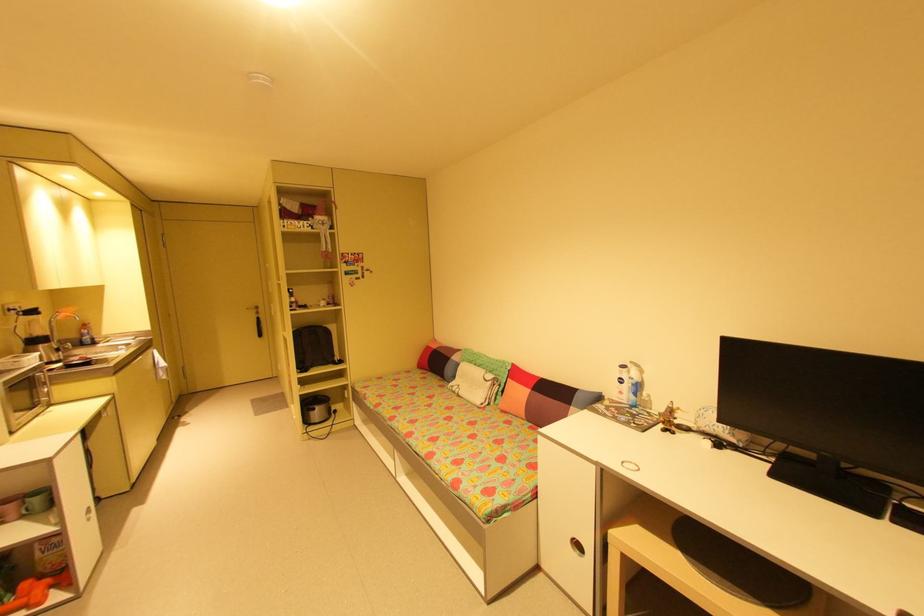
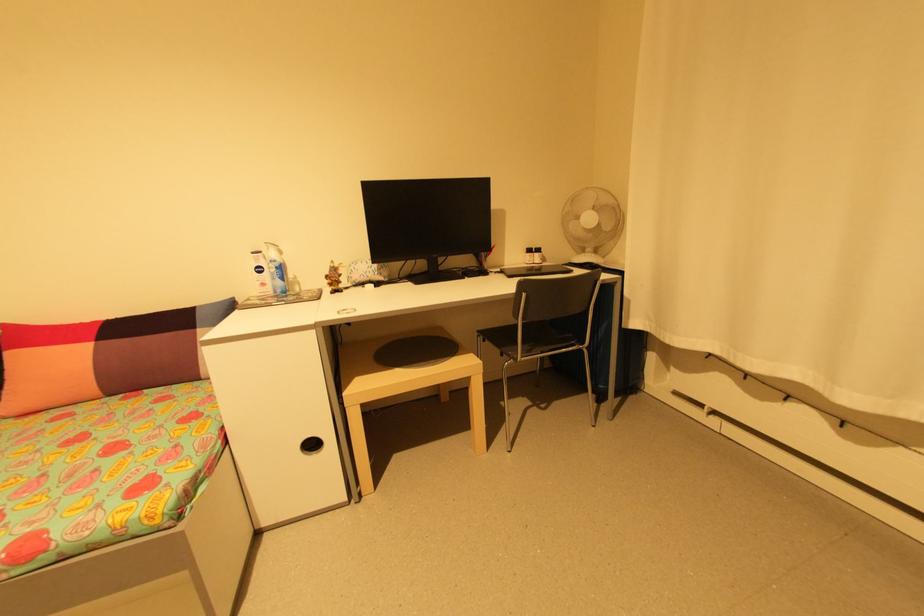
Question: How did the camera likely rotate?

Choices:
 (A) Left
 (B) Right
 (C) Up
 (D) Down

Answer: (B)